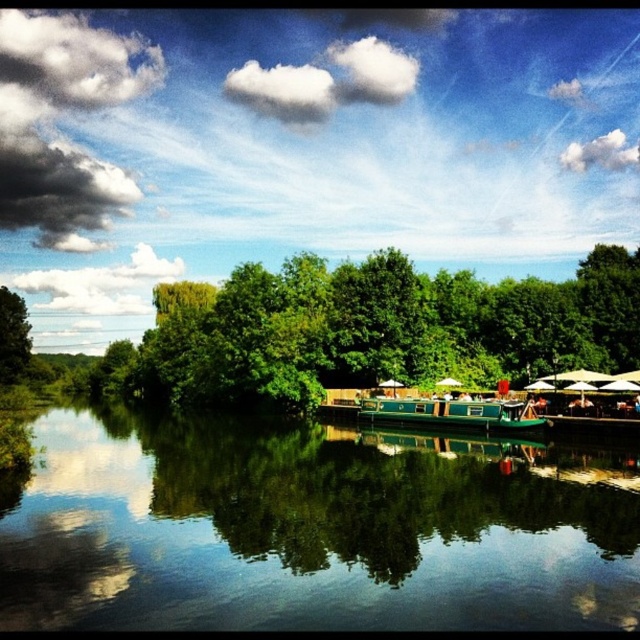
Is point (406, 412) positioned behind point (17, 330)?

That is False.

Does point (480, 406) lie behind point (4, 378)?

That is False.

This screenshot has height=640, width=640. I want to click on green polished wood boat at center, so click(452, 413).

Which is in front, point (90, 532) or point (406, 413)?

Point (90, 532) is more forward.

Can you confirm if green glossy boat at center is smaller than green polished wood boat at center?

Actually, green glossy boat at center might be larger than green polished wood boat at center.

Who is more distant from viewer, (477,564) or (400,400)?

The point (400,400) is more distant.

Identify the location of green glossy boat at center. The width and height of the screenshot is (640, 640). point(310,531).

Who is taller, green glossy boat at center or green leafy tree at left?

Standing taller between the two is green leafy tree at left.

How much distance is there between green glossy boat at center and green leafy tree at left?

green glossy boat at center is 70.48 meters from green leafy tree at left.

Locate an element on the screen. The image size is (640, 640). green glossy boat at center is located at coordinates (310, 531).

Identify the location of green glossy boat at center. (310, 531).